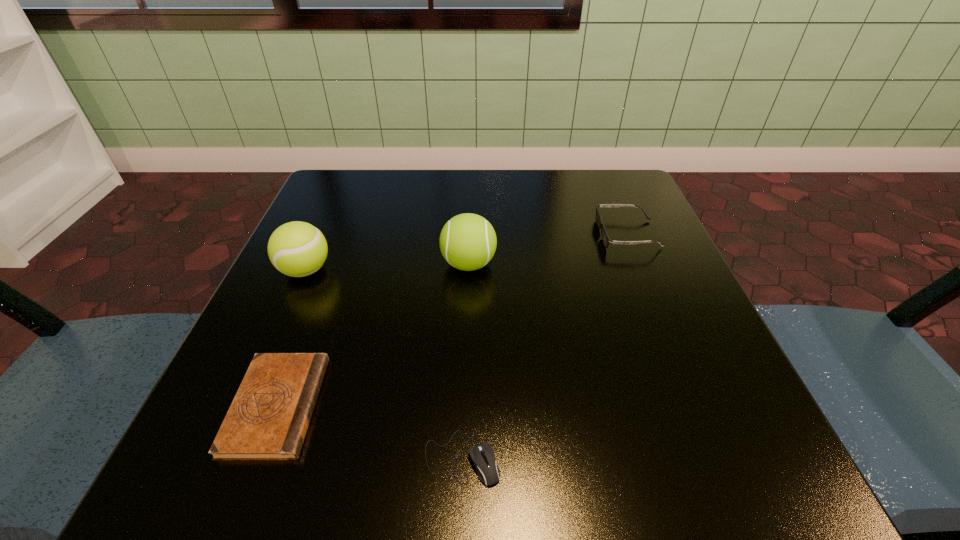
Find the location of a particular element. This screenshot has width=960, height=540. free spot that satisfies the following two spatial constraints: 1. on the front-facing side of the sunglasses; 2. on the front side of the computer mouse is located at coordinates (720, 457).

Locate an element on the screen. free region that satisfies the following two spatial constraints: 1. on the front side of the left tennis ball; 2. on the right side of the computer mouse is located at coordinates (222, 457).

Where is `vacant space that satisfies the following two spatial constraints: 1. on the spine side of the diary; 2. on the right side of the computer mouse`? This screenshot has height=540, width=960. vacant space that satisfies the following two spatial constraints: 1. on the spine side of the diary; 2. on the right side of the computer mouse is located at coordinates (256, 457).

Where is `vacant point that satisfies the following two spatial constraints: 1. on the front-facing side of the third shortest object; 2. on the front side of the computer mouse`? The image size is (960, 540). vacant point that satisfies the following two spatial constraints: 1. on the front-facing side of the third shortest object; 2. on the front side of the computer mouse is located at coordinates (720, 457).